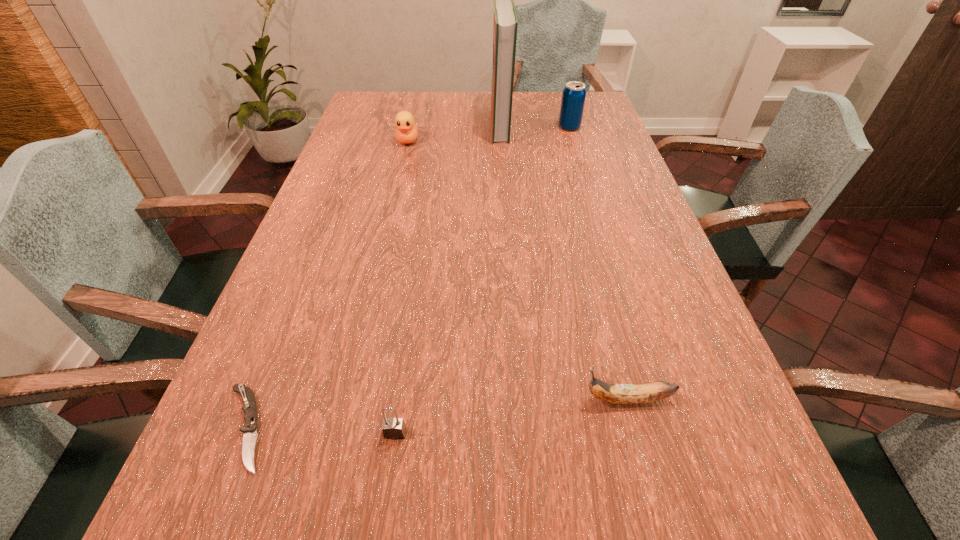
This screenshot has width=960, height=540. Find the location of `pop soda positioned at the right edge`. pop soda positioned at the right edge is located at coordinates (574, 93).

Find the location of a particular element. The height and width of the screenshot is (540, 960). banana that is at the right edge is located at coordinates (624, 394).

In the image, there is a desktop. Where is `vacant space at the far edge`? vacant space at the far edge is located at coordinates (523, 100).

In the image, there is a desktop. Where is `vacant space at the left edge`? The height and width of the screenshot is (540, 960). vacant space at the left edge is located at coordinates (351, 125).

In the image, there is a desktop. Where is `free space at the right edge`? free space at the right edge is located at coordinates (631, 227).

The image size is (960, 540). In the image, there is a desktop. In order to click on vacant space at the far left corner in this screenshot , I will do `click(371, 93)`.

Find the location of a particular element. This screenshot has width=960, height=540. free space between the banana and the hardback book is located at coordinates (564, 262).

The width and height of the screenshot is (960, 540). In order to click on vacant area that lies between the shortest object and the tallest object in this screenshot , I will do `click(372, 277)`.

Identify the location of empty space between the padlock and the second tallest object. This screenshot has width=960, height=540. (482, 280).

This screenshot has height=540, width=960. Identify the location of vacant point located between the pop soda and the fourth object from right to left. (482, 280).